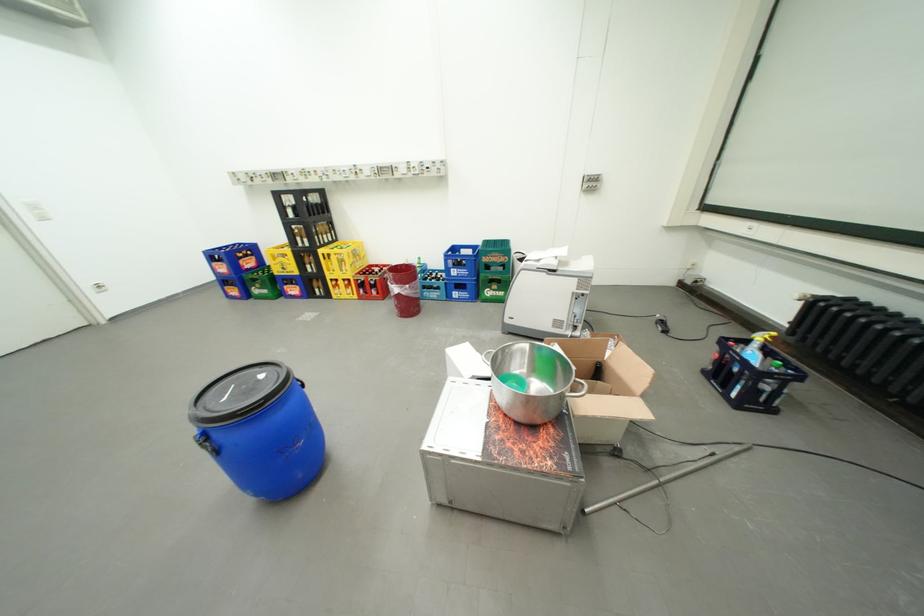
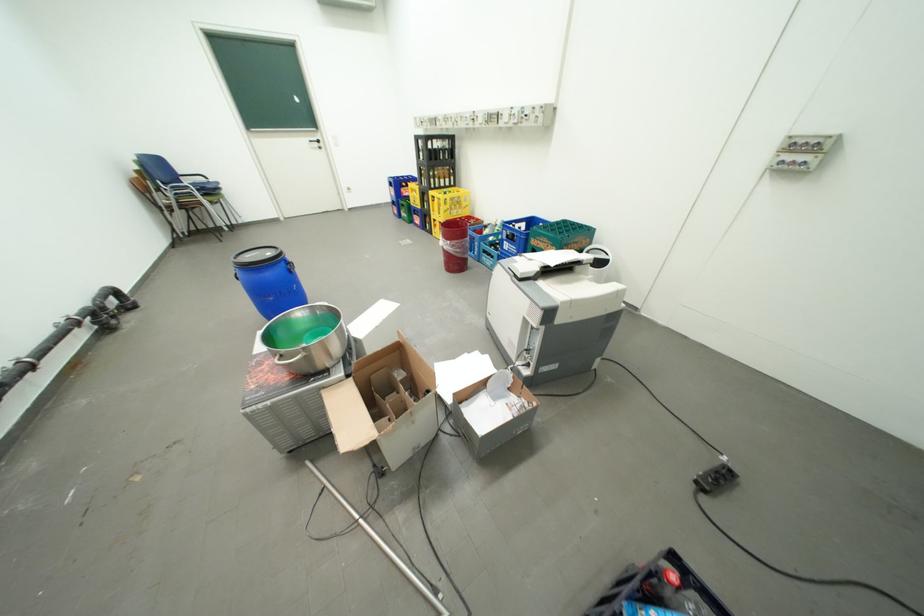
In the second image, find the point that corresponds to point 634,506 in the first image.

(334, 492)